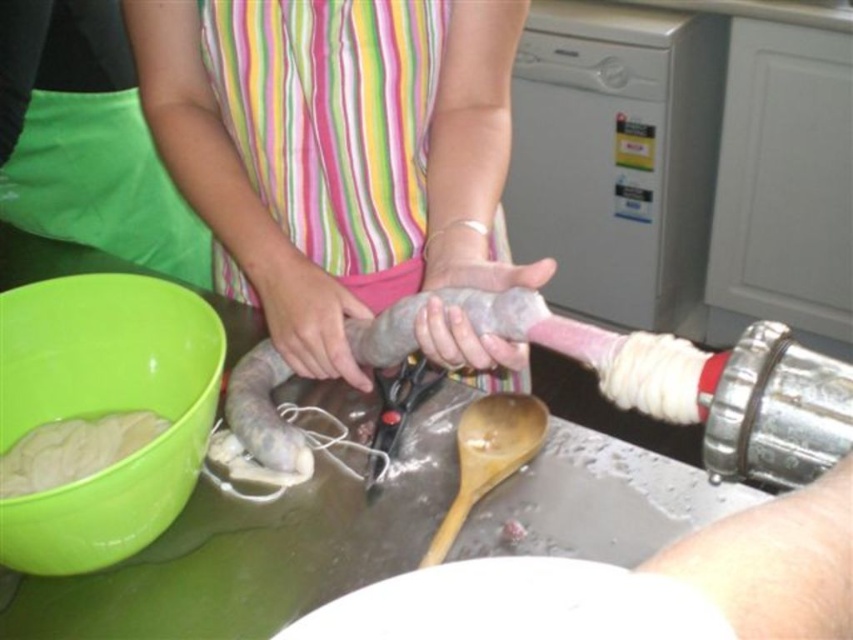
Between pink rubber sausage at center and green plastic bowl at lower left, which one appears on the right side from the viewer's perspective?

pink rubber sausage at center is more to the right.

What do you see at coordinates (235, 193) in the screenshot? The image size is (853, 640). I see `pink rubber sausage at center` at bounding box center [235, 193].

Between point (546, 275) and point (132, 358), which one is positioned in front?

Positioned in front is point (546, 275).

Where is `pink rubber sausage at center`? This screenshot has height=640, width=853. pink rubber sausage at center is located at coordinates (235, 193).

Is white matte bowl at lower center to the left of wooden spoon at center from the viewer's perspective?

Correct, you'll find white matte bowl at lower center to the left of wooden spoon at center.

Who is more forward, (463, 625) or (538, 435)?

Point (463, 625)

Locate an element on the screen. white matte bowl at lower center is located at coordinates (515, 604).

Does point (492, 74) come behind point (436, 604)?

Yes, it is.

Does pink rubber sausage at center have a greater width compared to white matte bowl at lower center?

Yes, pink rubber sausage at center is wider than white matte bowl at lower center.

What do you see at coordinates (235, 193) in the screenshot? I see `pink rubber sausage at center` at bounding box center [235, 193].

Locate an element on the screen. The height and width of the screenshot is (640, 853). pink rubber sausage at center is located at coordinates (235, 193).